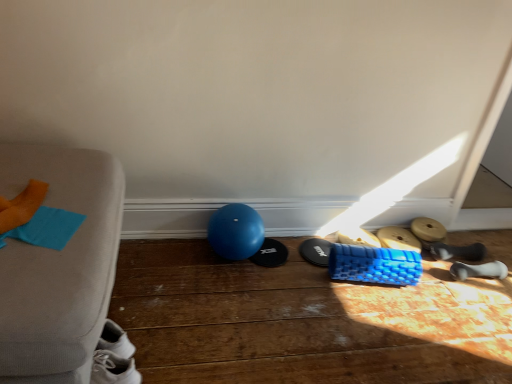
I want to click on free space in front of white rubber dumbbell at lower right, which is the 1th footwear from right to left, so click(x=480, y=307).